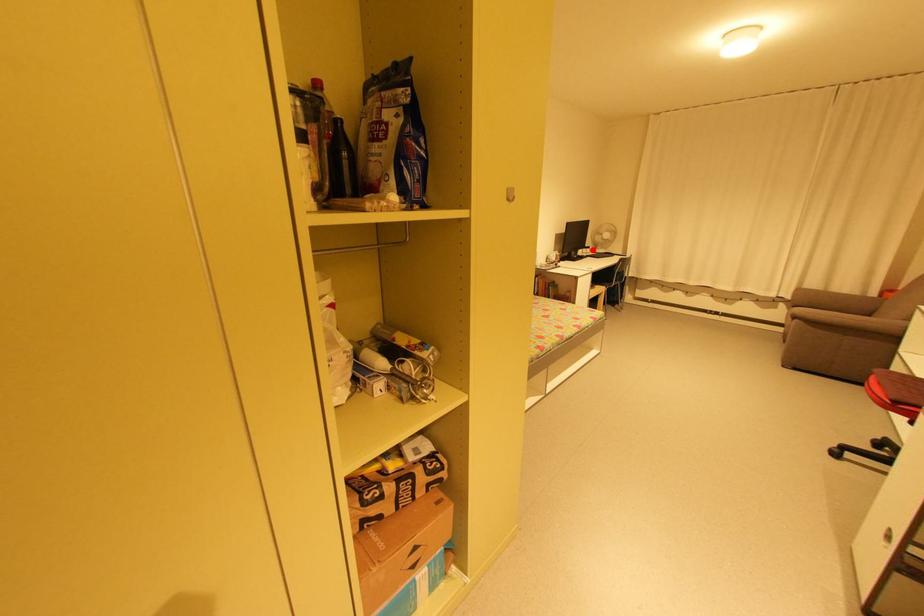
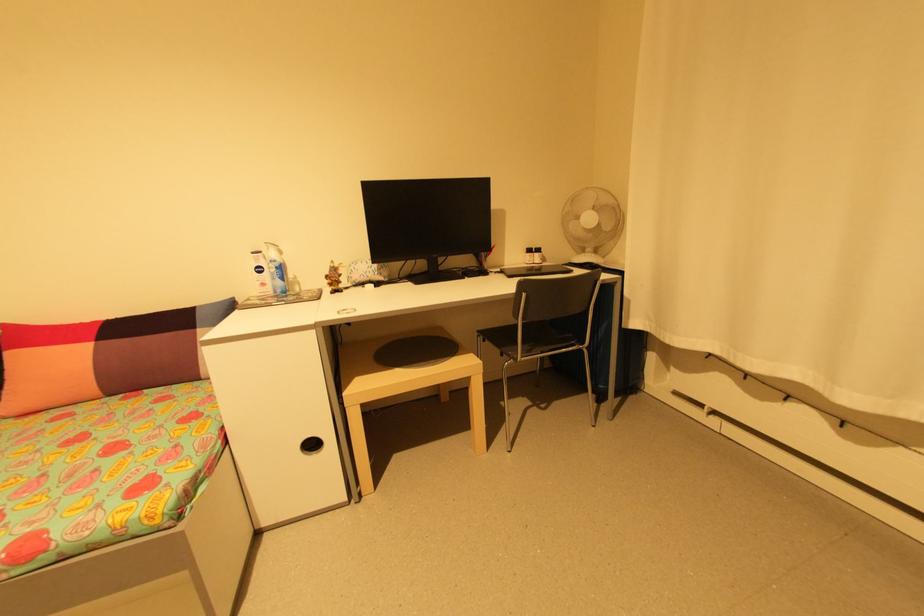
In the second image, find the point that corresponds to the highlighted location in the first image.

(541, 254)